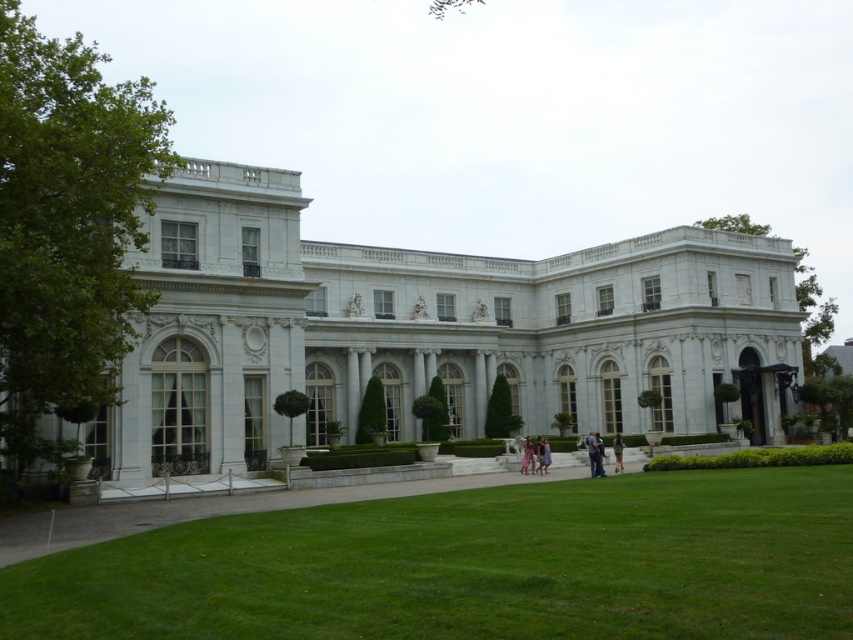
You are a photographer planning to take a picture of the white marble mansion at center and the green grass at center. If you want to emphasize the mansion in your photo, which object should you focus on first and why?

You should focus on the white marble mansion at center first because it has a greater height compared to the green grass at center, making it a more prominent subject in the scene.

You are planning to host a garden party and need to determine how much space will be available for guests. Given the white marble mansion at center and the green grass at center, which object occupies more area in the image?

The white marble mansion at center has a larger size compared to green grass at center, so it occupies more area in the image.

You are a drone operator trying to capture aerial footage of the white marble mansion at center and the green grass at center. From your current position, which object would you need to adjust your altitude to see more clearly?

The white marble mansion at center is above the green grass at center, so you would need to lower your altitude to see the green grass at center more clearly and raise it to capture the mansion properly.